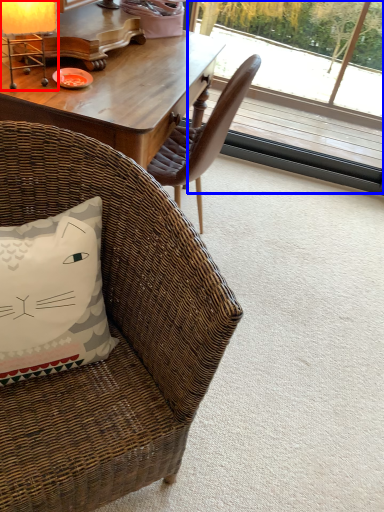
Question: Which object appears closest to the camera in this image, table lamp (highlighted by a red box) or window screen (highlighted by a blue box)?

Choices:
 (A) table lamp
 (B) window screen

Answer: (A)